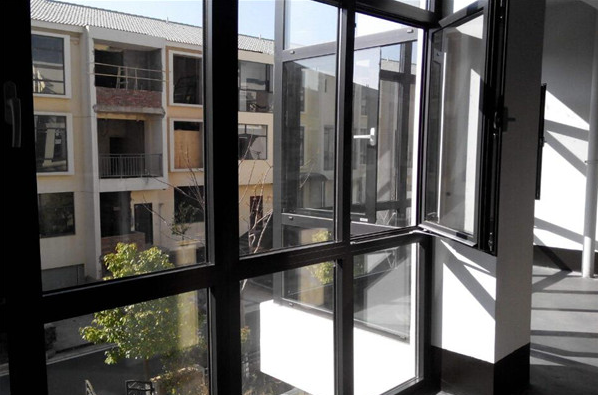
Find the location of a particular element. white wall is located at coordinates (566, 169).